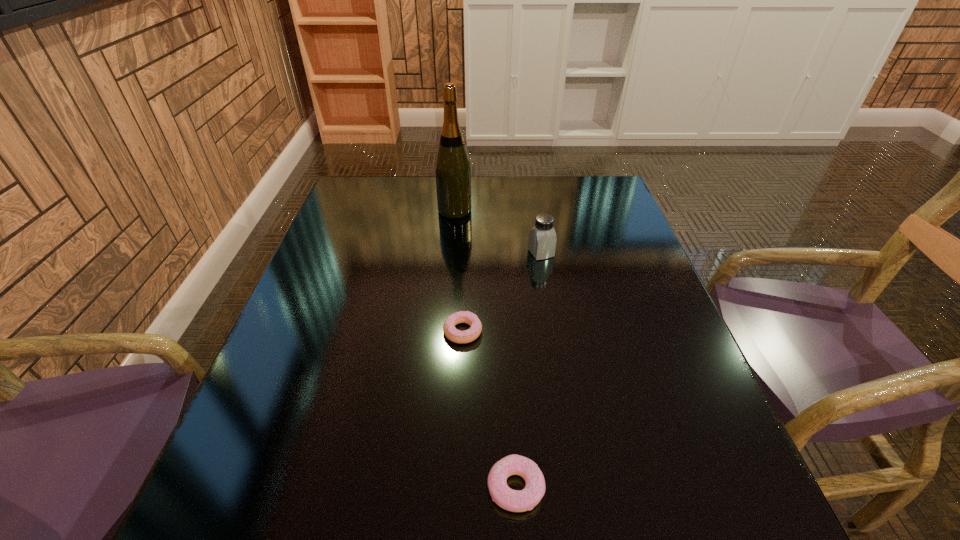
At what (x,y) coordinates should I click in order to perform the action: click on free spot located on the front of the left doughnut. Please return your answer as a coordinate pair (x, y). Looking at the image, I should click on (460, 405).

Where is `free region located 0.120m on the right of the second object from right to left`? This screenshot has height=540, width=960. free region located 0.120m on the right of the second object from right to left is located at coordinates (620, 488).

Where is `object present at the far edge`? object present at the far edge is located at coordinates (452, 167).

This screenshot has width=960, height=540. Identify the location of object that is at the near edge. (511, 500).

In the image, there is a desktop. What are the coordinates of `vacant space at the far edge` in the screenshot? It's located at (519, 193).

In the image, there is a desktop. At what (x,y) coordinates should I click in order to perform the action: click on vacant region at the near edge. Please return your answer as a coordinate pair (x, y). This screenshot has height=540, width=960. Looking at the image, I should click on tap(614, 532).

What are the coordinates of `free space at the left edge` in the screenshot? It's located at (341, 276).

Where is `vacant region at the right edge`? vacant region at the right edge is located at coordinates (620, 259).

Locate an element on the screen. The image size is (960, 540). free point at the far right corner is located at coordinates (609, 188).

This screenshot has width=960, height=540. Find the location of `vacant point located between the farther doughnut and the right doughnut`. vacant point located between the farther doughnut and the right doughnut is located at coordinates (490, 409).